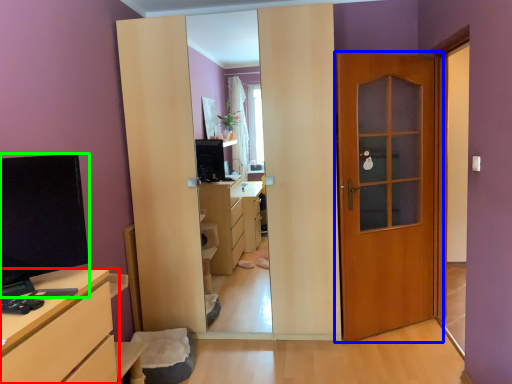
Question: Which is nearer to the chest of drawers (highlighted by a red box)? door (highlighted by a blue box) or open (highlighted by a green box).

Choices:
 (A) door
 (B) open

Answer: (B)